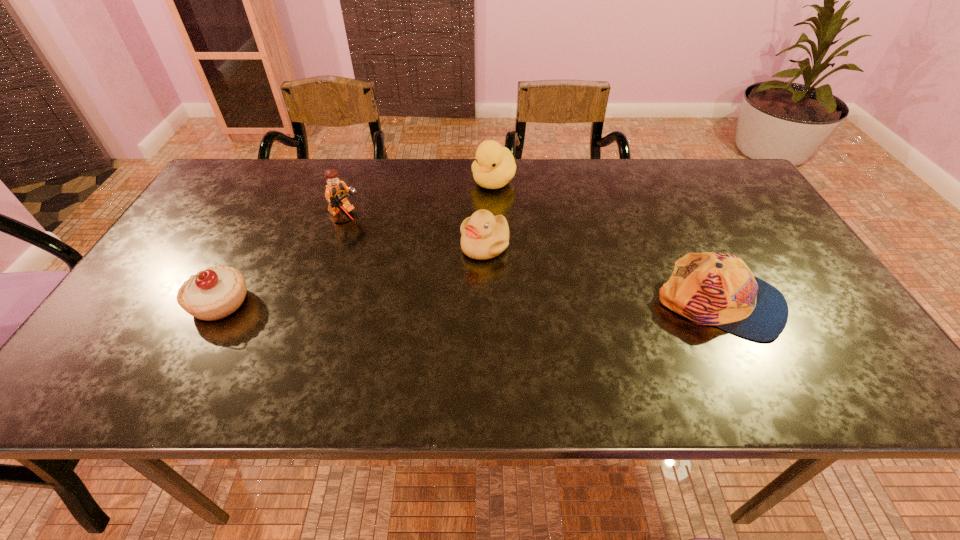
Identify the location of free space that satisfies the following two spatial constraints: 1. on the front side of the cap; 2. on the bill of the pastry. This screenshot has width=960, height=540. (219, 304).

Image resolution: width=960 pixels, height=540 pixels. In order to click on free location that satisfies the following two spatial constraints: 1. on the front side of the rightmost object; 2. on the bill of the duckling in this screenshot , I will do [485, 304].

The height and width of the screenshot is (540, 960). Find the location of `vacant position in the image that satisfies the following two spatial constraints: 1. on the front side of the rightmost object; 2. on the bill of the duckling`. vacant position in the image that satisfies the following two spatial constraints: 1. on the front side of the rightmost object; 2. on the bill of the duckling is located at coordinates (485, 304).

Locate an element on the screen. free point that satisfies the following two spatial constraints: 1. on the front side of the rightmost object; 2. on the bill of the farthest object is located at coordinates (498, 304).

You are a GUI agent. You are given a task and a screenshot of the screen. Output one action in this format:
    pyautogui.click(x=<x>, y=<y>)
    Task: Click on the free point that satisfies the following two spatial constraints: 1. on the front side of the fourth object from right to left; 2. on the right side of the duckling
    
    Given the screenshot: What is the action you would take?
    pyautogui.click(x=336, y=246)

Find the location of a particular element. The image size is (960, 540). vacant region that satisfies the following two spatial constraints: 1. on the back side of the leftmost object; 2. on the right side of the duck is located at coordinates (285, 181).

Locate an element on the screen. This screenshot has width=960, height=540. blank space that satisfies the following two spatial constraints: 1. on the front side of the rightmost object; 2. on the bill of the second object from left to right is located at coordinates (317, 304).